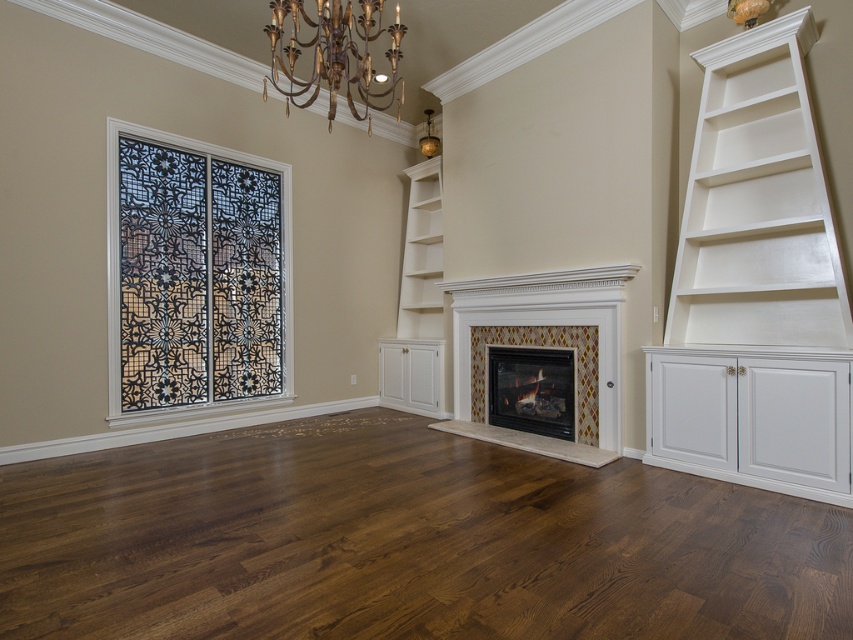
Question: Which object is the closest to the gold metallic chandelier at upper center?

Choices:
 (A) matte black fireplace at center
 (B) white wood shelf at center
 (C) stained glass window at left
 (D) dark brown wood flooring at center

Answer: (C)

Question: Can you confirm if gold metallic chandelier at upper center is wider than matte black fireplace at center?

Choices:
 (A) no
 (B) yes

Answer: (B)

Question: Can you confirm if gold metallic chandelier at upper center is positioned to the left of white wood shelf at center?

Choices:
 (A) no
 (B) yes

Answer: (B)

Question: Which of the following is the farthest from the observer?

Choices:
 (A) stained glass window at left
 (B) white painted wood bookshelf at right

Answer: (A)

Question: Which object is farther from the camera taking this photo?

Choices:
 (A) matte black fireplace at center
 (B) stained glass window at left

Answer: (A)

Question: Can you confirm if gold metallic chandelier at upper center is bigger than white wood shelf at center?

Choices:
 (A) yes
 (B) no

Answer: (A)